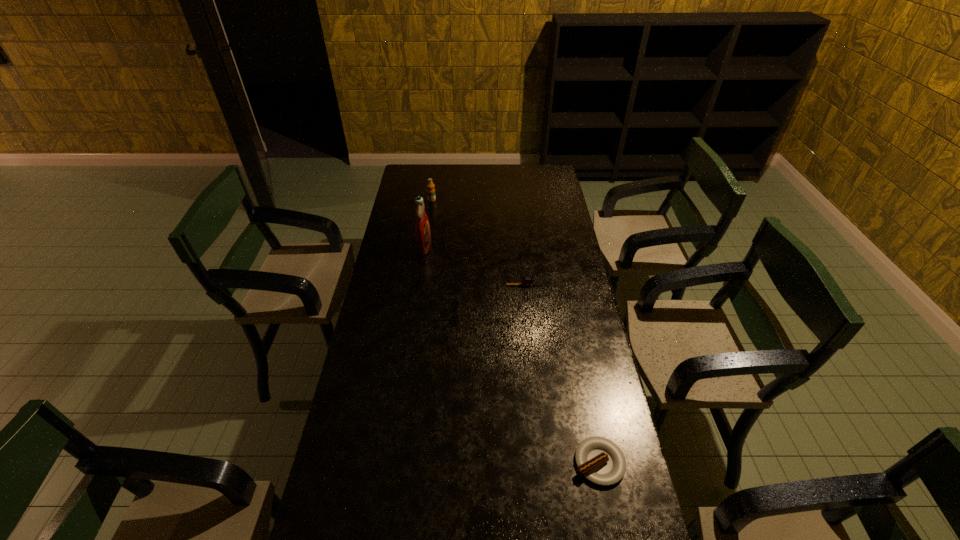
This screenshot has height=540, width=960. What are the coordinates of `vacant region located 0.290m on the front surface of the tallest object` in the screenshot? It's located at click(496, 246).

This screenshot has height=540, width=960. In order to click on vacant region located on the label of the orange juice in this screenshot , I will do `click(430, 213)`.

Identify the location of vacant space situated on the front-facing side of the third object from left to right. The width and height of the screenshot is (960, 540). (546, 311).

In order to click on vacant space located 0.310m on the front of the third nearest object in this screenshot , I will do `click(532, 348)`.

In order to click on free space located 0.350m on the left of the rightmost object in this screenshot , I will do `click(451, 462)`.

The width and height of the screenshot is (960, 540). I want to click on detergent positioned at the left edge, so click(x=422, y=229).

Locate an element on the screen. This screenshot has height=540, width=960. orange juice present at the left edge is located at coordinates (430, 186).

Identify the location of tape measure that is positioned at the right edge. (526, 281).

Identify the location of sausage at the right edge. The height and width of the screenshot is (540, 960). (600, 460).

In the image, there is a desktop. At what (x,y) coordinates should I click in order to perform the action: click on vacant space at the far edge. Please return your answer as a coordinate pair (x, y). The width and height of the screenshot is (960, 540). Looking at the image, I should click on (492, 174).